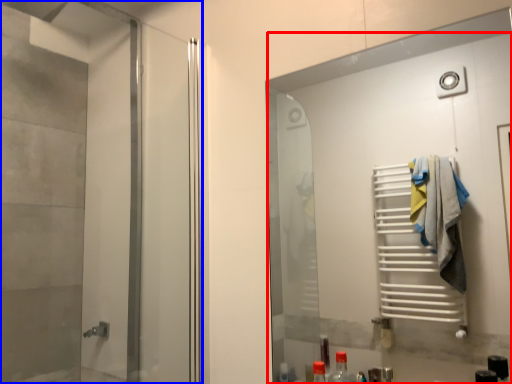
Question: Which object is closer to the camera taking this photo, door (highlighted by a red box) or elevator (highlighted by a blue box)?

Choices:
 (A) door
 (B) elevator

Answer: (A)